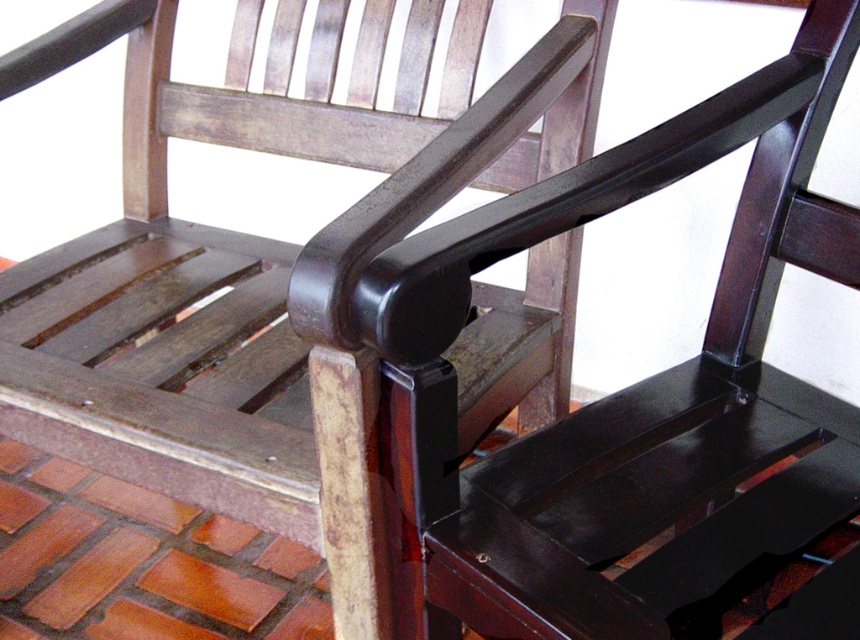
You are sitting in the wooden rocking chair and want to place a book on the armrest. Which armrest, the glossy dark wood armrest at center or the glossy black armrest at center, is closer to you?

The glossy dark wood armrest at center is closer to you because it is positioned in front of the glossy black armrest at center.

You are an interior designer assessing the dimensions of the chair. Which armrest is shorter between the glossy dark wood armrest at center and the glossy black armrest at center?

The glossy dark wood armrest at center is shorter than the glossy black armrest at center.

Based on the photo, you are designing a new rocking chair and want to ensure the armrests are appropriately sized for comfort. Given the scene, which armrest between the glossy dark wood armrest at center and the glossy black armrest at center is more suitable for someone who prefers a narrower grip?

The glossy dark wood armrest at center is thinner than the glossy black armrest at center, making it more suitable for someone who prefers a narrower grip.